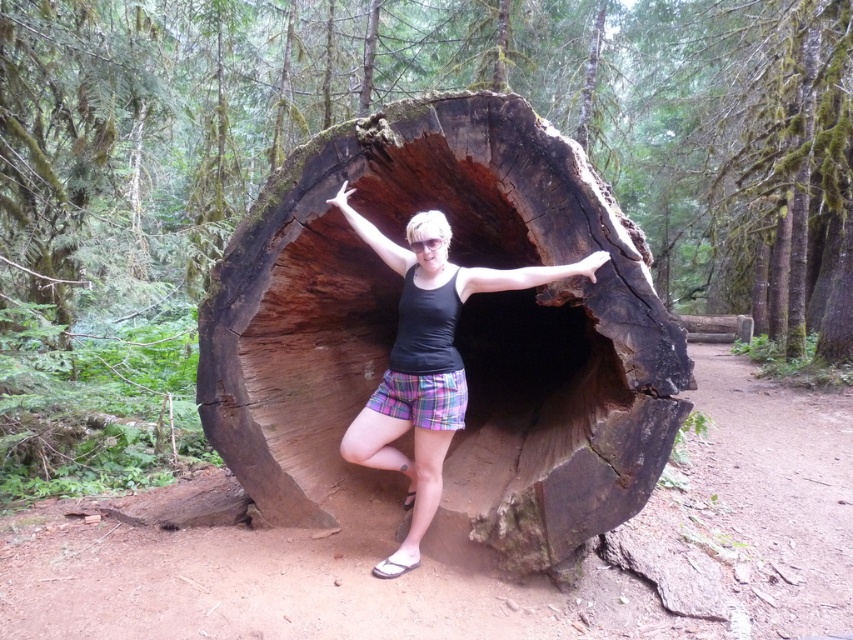
Question: Which of the following is the closest to the observer?

Choices:
 (A) (363, 236)
 (B) (305, 176)

Answer: (A)

Question: Can you confirm if dark brown wood log at center is wider than plaid shorts at center?

Choices:
 (A) no
 (B) yes

Answer: (B)

Question: Which of the following is the farthest from the observer?

Choices:
 (A) plaid shorts at center
 (B) dark brown wood log at center

Answer: (A)

Question: Does dark brown wood log at center come behind plaid shorts at center?

Choices:
 (A) yes
 (B) no

Answer: (B)

Question: Is dark brown wood log at center further to camera compared to plaid shorts at center?

Choices:
 (A) no
 (B) yes

Answer: (A)